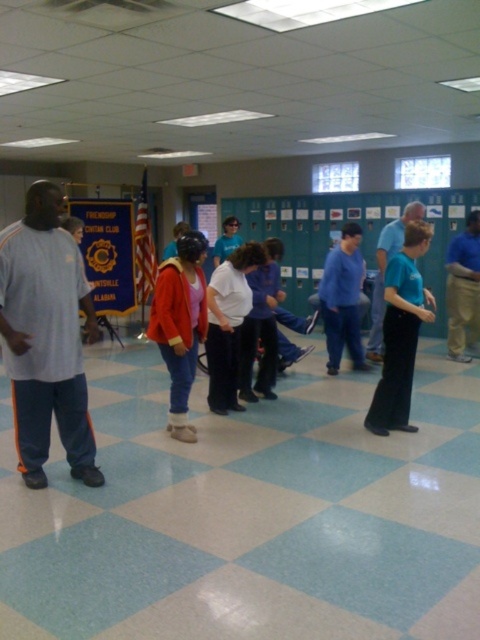
Question: Can you confirm if matte gray sweatshirt at left is positioned below white matte shirt at center?

Choices:
 (A) yes
 (B) no

Answer: (A)

Question: Among these points, which one is nearest to the camera?

Choices:
 (A) (469, 292)
 (B) (355, 356)
 (C) (223, 332)

Answer: (C)

Question: Is blue fabric shirt at center positioned at the back of teal matte shirt at center?

Choices:
 (A) no
 (B) yes

Answer: (B)

Question: Which object is the closest to the matte orange sweater at center?

Choices:
 (A) matte gray sweatshirt at left
 (B) white matte shirt at center
 (C) blue fabric shirt at center

Answer: (B)

Question: Can you confirm if matte orange sweater at center is thinner than blue cotton shirt at center?

Choices:
 (A) no
 (B) yes

Answer: (B)

Question: Which is nearer to the blue cotton shirt at center?

Choices:
 (A) matte orange sweater at center
 (B) blue fabric shirt at center
 (C) white matte shirt at center
 (D) matte gray sweatshirt at left

Answer: (B)